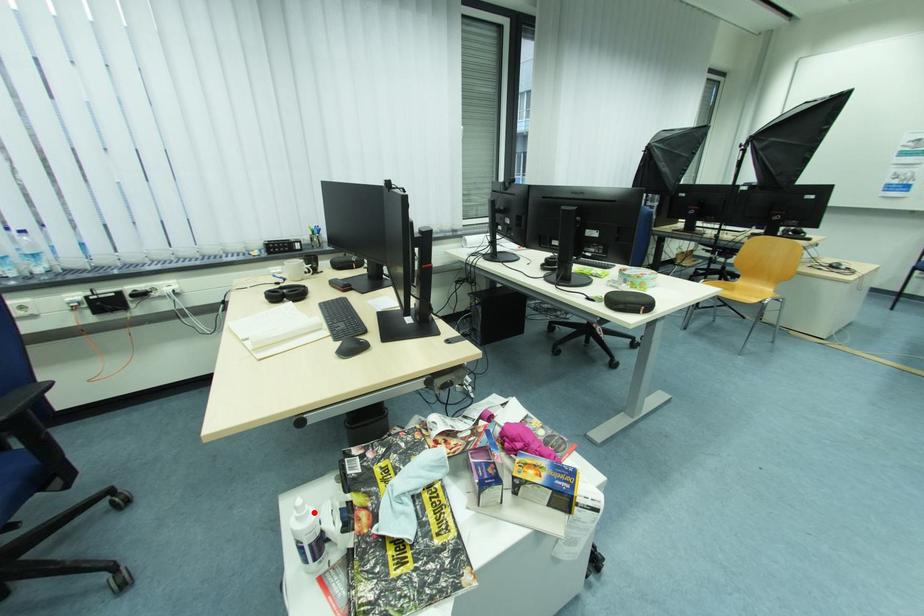
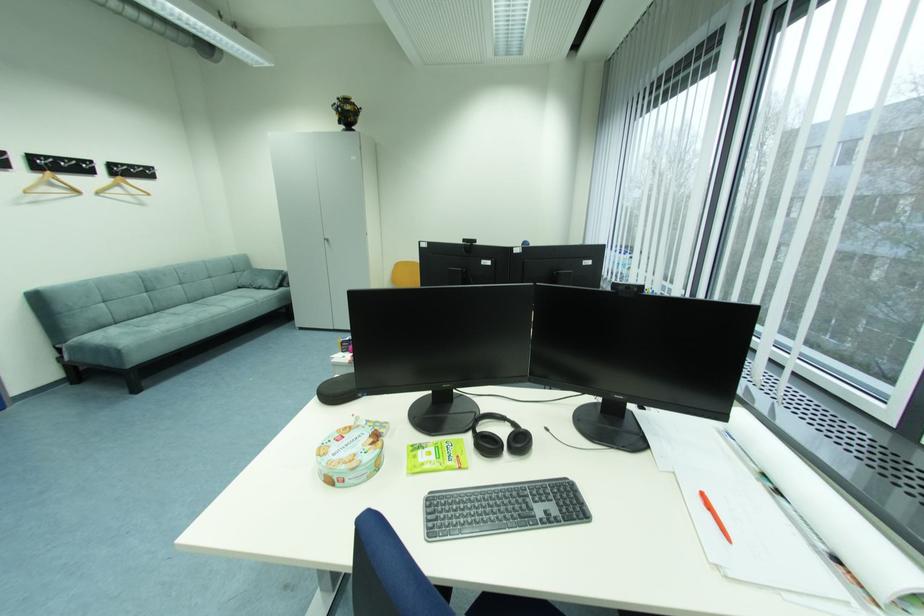
Question: I am providing you with two images of the same scene from different viewpoints. A red point is marked on the first image. At the location where the point appears in image 1, is it still visible in image 2?

Choices:
 (A) Yes
 (B) No

Answer: (B)